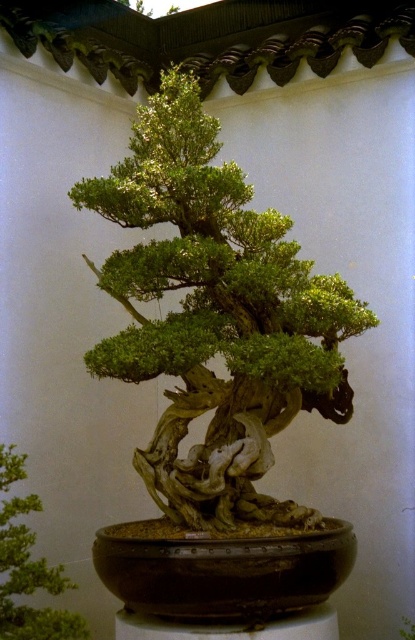
Does green textured bonsai at center come behind green matte bonsai tree at center?

Yes, it is.

Which is in front, point (287, 403) or point (19, 593)?

Point (19, 593) is in front.

This screenshot has height=640, width=415. Find the location of `green textured bonsai at center`. green textured bonsai at center is located at coordinates (215, 316).